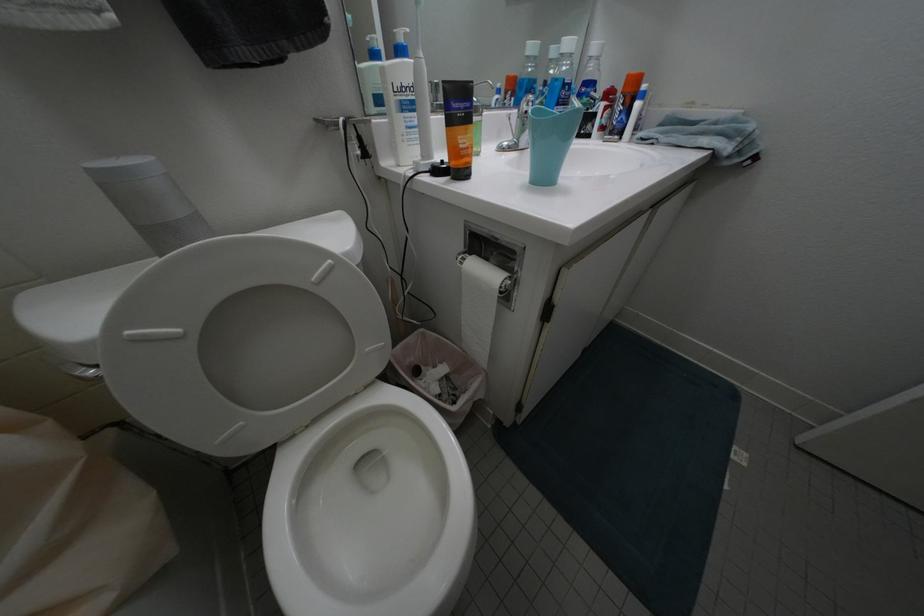
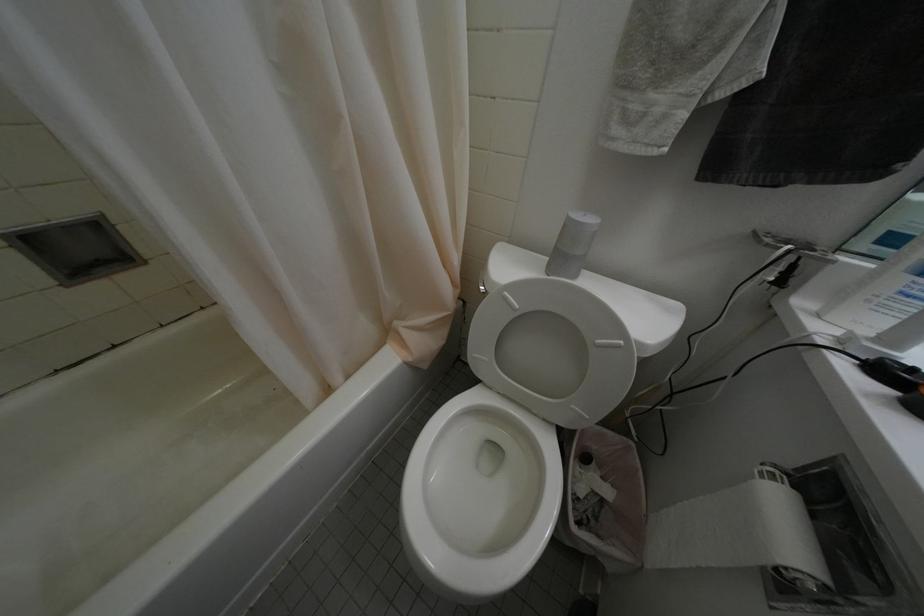
First-person continuous shooting, in which direction is the camera rotating?

The camera rotated toward left-down.